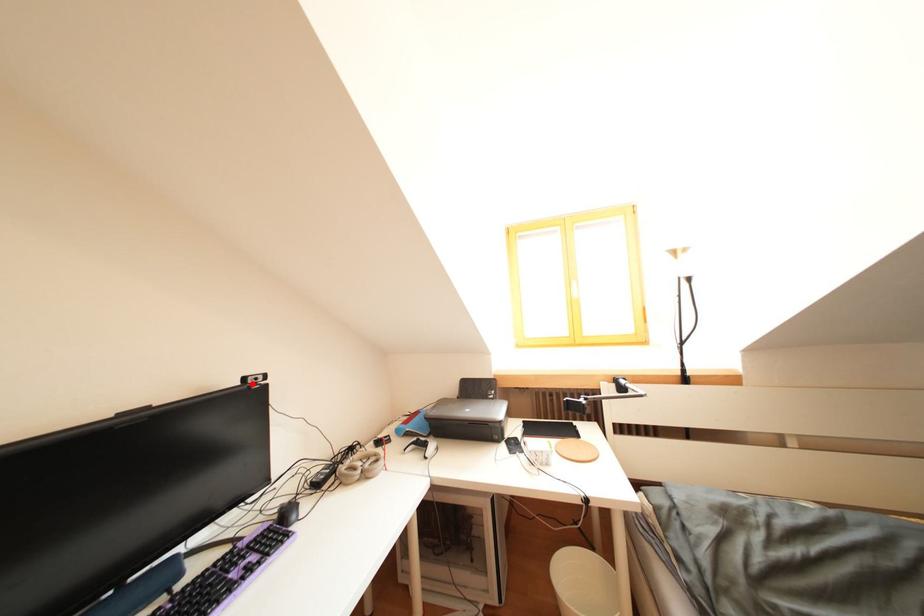
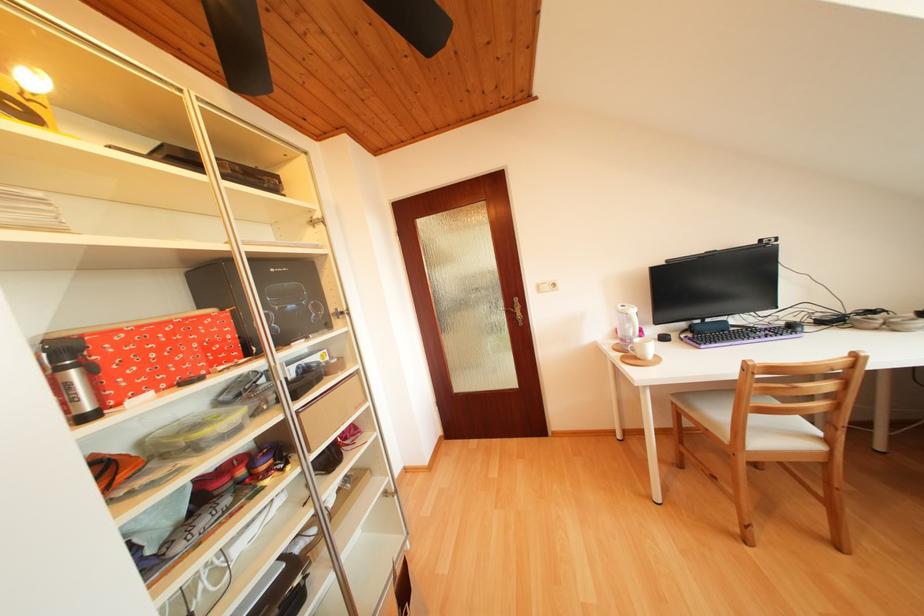
In the second image, find the point that corresponds to the highlighted location in the first image.

(769, 246)